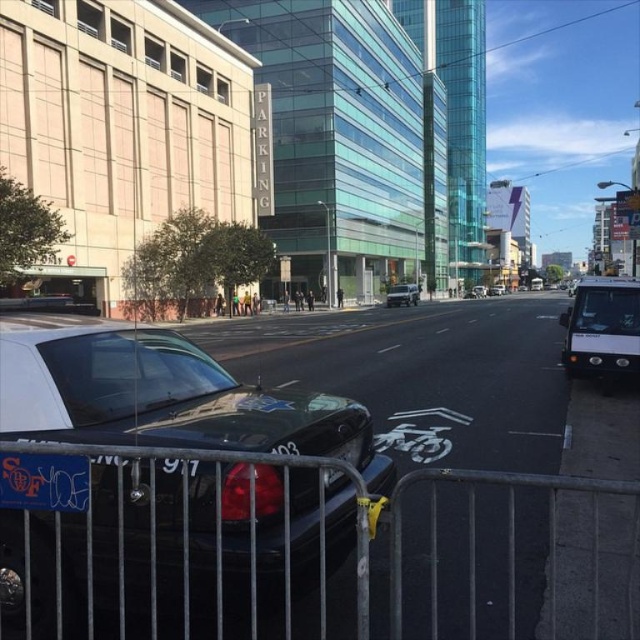
Question: Is matte black police car at center in front of black plastic license plate at center?

Choices:
 (A) no
 (B) yes

Answer: (B)

Question: Is metallic silver fence at lower center to the left of white matte van at right from the viewer's perspective?

Choices:
 (A) no
 (B) yes

Answer: (B)

Question: Can you confirm if black plastic license plate at center is bigger than metallic silver van at center?

Choices:
 (A) no
 (B) yes

Answer: (A)

Question: Which of the following is the closest to the observer?

Choices:
 (A) (109, 416)
 (B) (388, 294)

Answer: (A)

Question: Which of the following is the farthest from the observer?

Choices:
 (A) black plastic license plate at center
 (B) matte black police car at center
 (C) metallic silver van at center
 (D) metallic silver fence at lower center

Answer: (C)

Question: Which point is farther to the camera?

Choices:
 (A) (70, 616)
 (B) (356, 451)

Answer: (B)